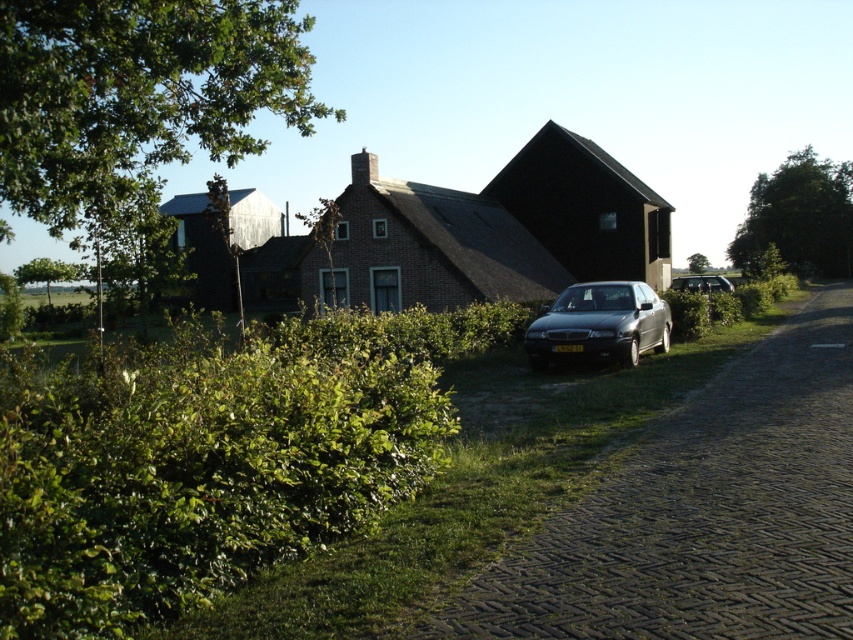
How far apart are satin black sedan at center and satin black sedan at center-right?

They are 13.33 meters apart.

In the scene shown: Does satin black sedan at center appear on the right side of satin black sedan at center-right?

In fact, satin black sedan at center is to the left of satin black sedan at center-right.

Is point (635, 307) less distant than point (721, 280)?

Yes, it is in front of point (721, 280).

Find the location of a particular element. satin black sedan at center is located at coordinates (601, 323).

How distant is green leafy hedge at lower left from dark gray cobblestone driveway at lower right?

green leafy hedge at lower left is 9.93 meters from dark gray cobblestone driveway at lower right.

Identify the location of green leafy hedge at lower left. (193, 472).

Image resolution: width=853 pixels, height=640 pixels. Describe the element at coordinates (193, 472) in the screenshot. I see `green leafy hedge at lower left` at that location.

The width and height of the screenshot is (853, 640). I want to click on green leafy hedge at lower left, so click(193, 472).

Is dark gray cobblestone driveway at lower right to the right of satin black sedan at center from the viewer's perspective?

Yes, dark gray cobblestone driveway at lower right is to the right of satin black sedan at center.

Who is more forward, (x=451, y=624) or (x=665, y=308)?

Point (x=451, y=624) is more forward.

Where is `dark gray cobblestone driveway at lower right`? The width and height of the screenshot is (853, 640). dark gray cobblestone driveway at lower right is located at coordinates (701, 513).